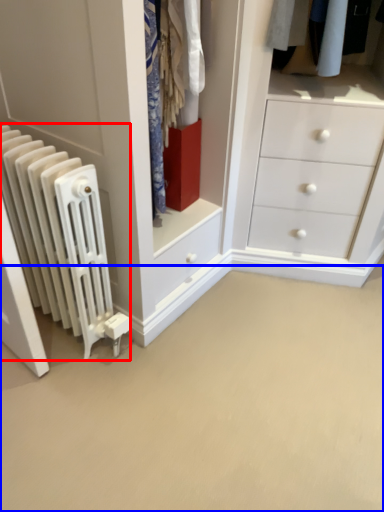
Question: Among these objects, which one is farthest to the camera, radiator (highlighted by a red box) or plain (highlighted by a blue box)?

Choices:
 (A) radiator
 (B) plain

Answer: (A)